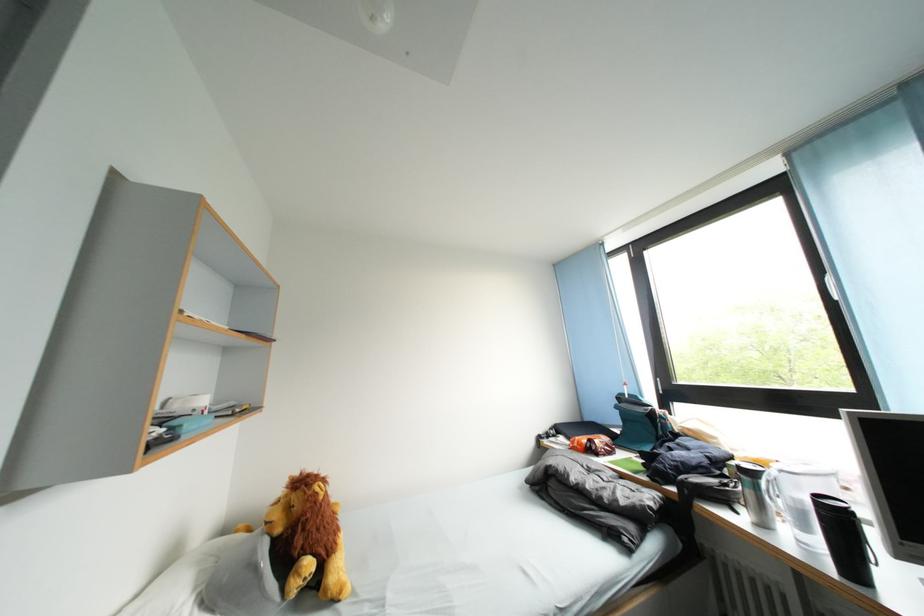
In order to click on orange snack bag in this screenshot , I will do coord(592,445).